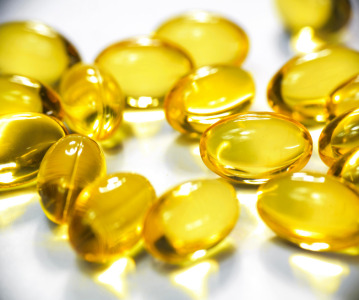
Identify the location of white counter top. The width and height of the screenshot is (359, 300). (158, 157), (34, 277), (245, 284).